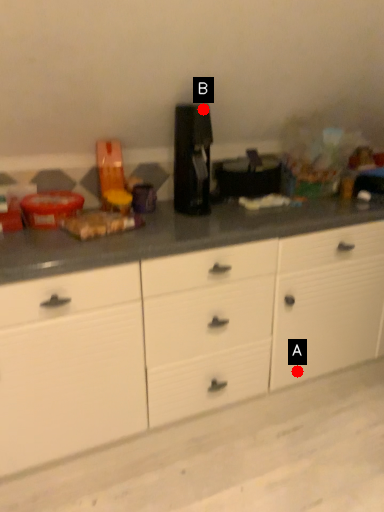
Question: Two points are circled on the image, labeled by A and B beside each circle. Which point is farther from the camera taking this photo?

Choices:
 (A) A is further
 (B) B is further

Answer: (A)